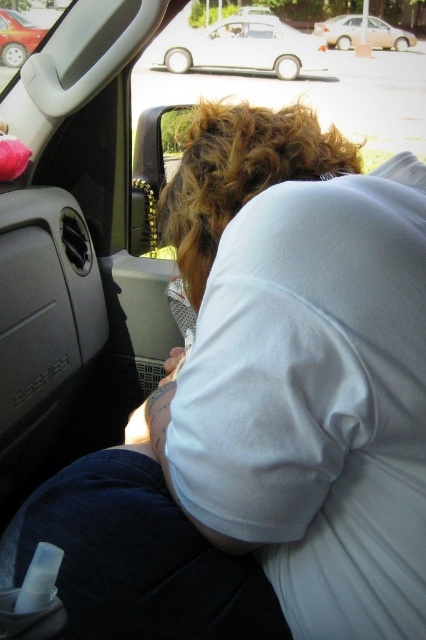
Is beige matte sedan at upper center closer to the viewer compared to metallic red car at upper left?

No.

Who is more forward, (386, 38) or (16, 17)?

Point (16, 17) is more forward.

Find the location of `beige matte sedan at upper center`. beige matte sedan at upper center is located at coordinates (339, 29).

Which is in front, point (169, 54) or point (388, 35)?

Positioned in front is point (169, 54).

Image resolution: width=426 pixels, height=640 pixels. Find the location of `white matte car at upper center`. white matte car at upper center is located at coordinates (242, 48).

Does white matte car at upper center appear on the left side of metallic red car at upper left?

No, white matte car at upper center is not to the left of metallic red car at upper left.

Is point (293, 68) in front of point (23, 16)?

That is False.

Locate an element on the screen. The image size is (426, 640). white matte car at upper center is located at coordinates (242, 48).